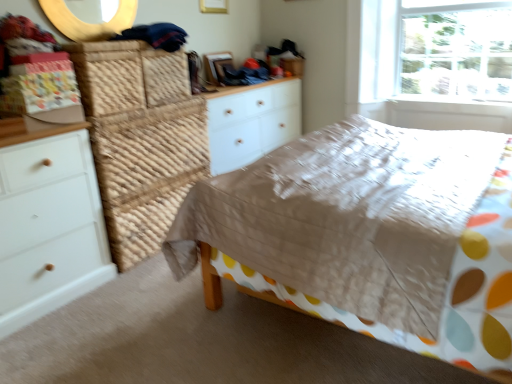
Question: Considering the positions of wooden round mirror at upper center and matte brown bed at center in the image, is wooden round mirror at upper center taller or shorter than matte brown bed at center?

Choices:
 (A) tall
 (B) short

Answer: (B)

Question: Considering their positions, is wooden round mirror at upper center located in front of or behind matte brown bed at center?

Choices:
 (A) front
 (B) behind

Answer: (B)

Question: Which object is the farthest from the matte brown bed at center?

Choices:
 (A) wooden round mirror at upper center
 (B) white wood chest of drawers at left, the 1th chest of drawers positioned from the left
 (C) white wood chest of drawers at center, which ranks as the first chest of drawers in back-to-front order
 (D) transparent glass window at upper right

Answer: (A)

Question: Considering the real-world distances, which object is closest to the wooden round mirror at upper center?

Choices:
 (A) white wood chest of drawers at center, arranged as the 1th chest of drawers when viewed from the right
 (B) matte brown bed at center
 (C) transparent glass window at upper right
 (D) white wood chest of drawers at left, arranged as the 2th chest of drawers when viewed from the right

Answer: (D)